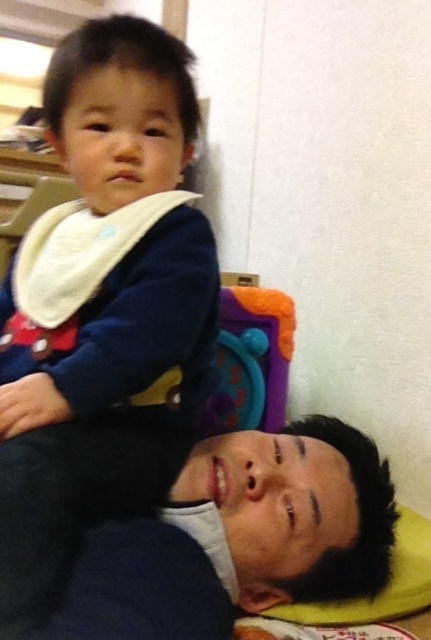
Please provide the exact 2D coordinates of the black matte shirt at lower left in the image. The coordinates should be in the format of a point like this example format, for instance, point A is at point 0.7, 0.3. Please answer with the coordinates in the same format as the example provided in the Objects Description. The question must mention the object labels from the Objects section exactly as given. The answer must use the Objects Description to provide the correct coordinates without any additional or

The black matte shirt at lower left is located at point (187, 529).

You are a photographer setting up a shoot in this scene. You need to place a small prop that is 12 inches wide between the black matte shirt at lower left and the white soft bib at upper left. Can the space between them accommodate the prop?

The black matte shirt at lower left is wider than the white soft bib at upper left. However, the question is about the space between them, not their individual widths. The provided description does not specify the distance between the two objects, so it cannot be determined if the 12 inch prop would fit.

You are a photographer setting up a shoot in this scene. You need to place a small prop at the coordinates point (x=187, y=529). What object is located at this point?

The point (x=187, y=529) corresponds to the black matte shirt at lower left.